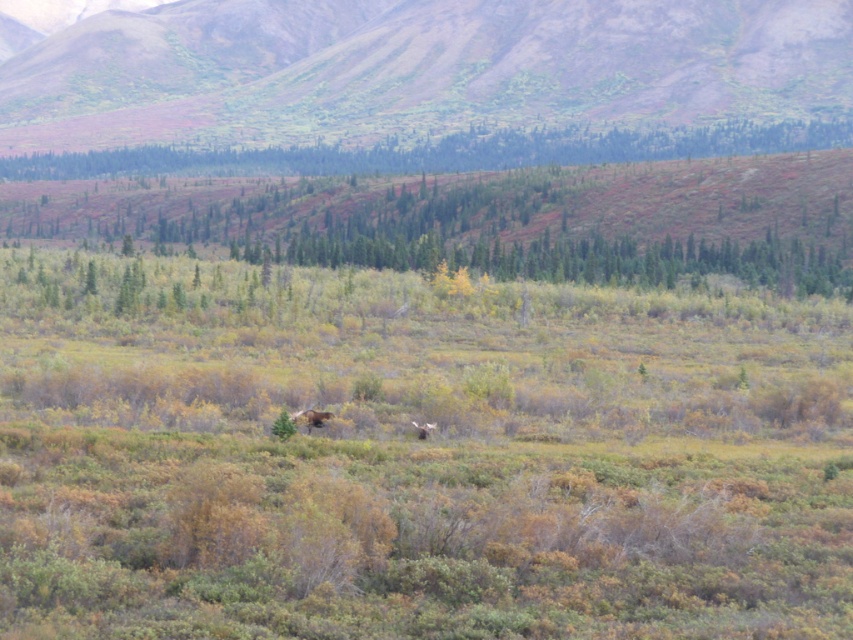
Question: Is green grassy hillside at upper center to the right of brown furry moose at center from the viewer's perspective?

Choices:
 (A) yes
 (B) no

Answer: (B)

Question: Does green grassy hillside at upper center appear over green leafy trees at upper center?

Choices:
 (A) yes
 (B) no

Answer: (A)

Question: Among these points, which one is nearest to the camera?

Choices:
 (A) (721, 92)
 (B) (297, 420)
 (C) (271, 168)
 (D) (421, 435)

Answer: (D)

Question: Based on their relative distances, which object is nearer to the green grassy hillside at upper center?

Choices:
 (A) green leafy trees at upper center
 (B) brown furry moose at center
 (C) brown furry bear at center

Answer: (A)

Question: Is green grassy hillside at upper center to the left of green leafy trees at upper center from the viewer's perspective?

Choices:
 (A) yes
 (B) no

Answer: (A)

Question: Which point is closer to the camera?

Choices:
 (A) green leafy trees at upper center
 (B) brown furry moose at center
 (C) green grassy hillside at upper center

Answer: (B)